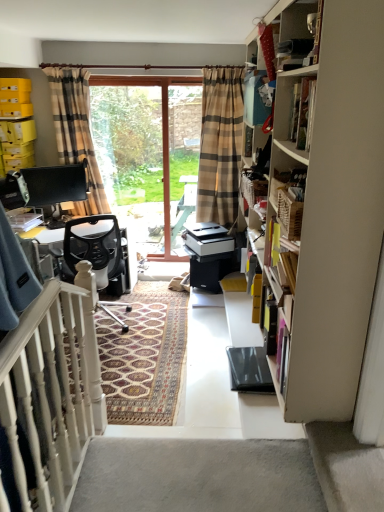
Question: Should I look upward or downward to see wooden cabinet at upper right?

Choices:
 (A) up
 (B) down

Answer: (A)

Question: Considering the relative sizes of black mesh office chair at center and white carpet at lower right in the image provided, is black mesh office chair at center bigger than white carpet at lower right?

Choices:
 (A) no
 (B) yes

Answer: (B)

Question: From the image's perspective, is black mesh office chair at center located above white carpet at lower right?

Choices:
 (A) yes
 (B) no

Answer: (A)

Question: Can you confirm if black mesh office chair at center is smaller than white carpet at lower right?

Choices:
 (A) no
 (B) yes

Answer: (A)

Question: Considering the relative sizes of black mesh office chair at center and white carpet at lower right in the image provided, is black mesh office chair at center wider than white carpet at lower right?

Choices:
 (A) no
 (B) yes

Answer: (B)

Question: Can white carpet at lower right be found inside black mesh office chair at center?

Choices:
 (A) no
 (B) yes

Answer: (A)

Question: From the image's perspective, does black mesh office chair at center appear lower than white carpet at lower right?

Choices:
 (A) yes
 (B) no

Answer: (B)

Question: Is white wooden balustrade at lower left turned away from wooden cabinet at upper right?

Choices:
 (A) yes
 (B) no

Answer: (B)

Question: Is white wooden balustrade at lower left oriented towards wooden cabinet at upper right?

Choices:
 (A) yes
 (B) no

Answer: (B)

Question: From a real-world perspective, does white wooden balustrade at lower left sit lower than wooden cabinet at upper right?

Choices:
 (A) yes
 (B) no

Answer: (A)

Question: Can you confirm if white wooden balustrade at lower left is positioned to the right of wooden cabinet at upper right?

Choices:
 (A) no
 (B) yes

Answer: (A)

Question: From a real-world perspective, does white wooden balustrade at lower left stand above wooden cabinet at upper right?

Choices:
 (A) yes
 (B) no

Answer: (B)

Question: Considering the relative sizes of white wooden balustrade at lower left and wooden cabinet at upper right in the image provided, is white wooden balustrade at lower left bigger than wooden cabinet at upper right?

Choices:
 (A) no
 (B) yes

Answer: (B)

Question: Does white carpet at lower right have a greater width compared to black mesh office chair at center?

Choices:
 (A) no
 (B) yes

Answer: (A)